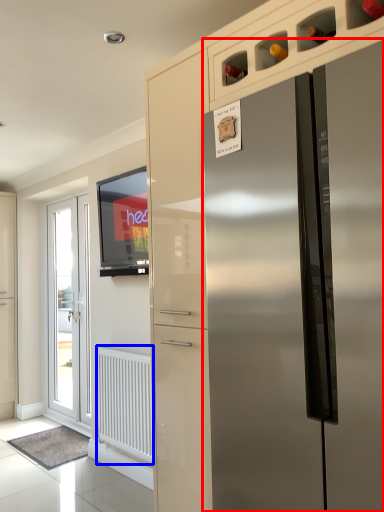
Question: Which point is further to the camera, refrigerator (highlighted by a red box) or radiator (highlighted by a blue box)?

Choices:
 (A) refrigerator
 (B) radiator

Answer: (B)